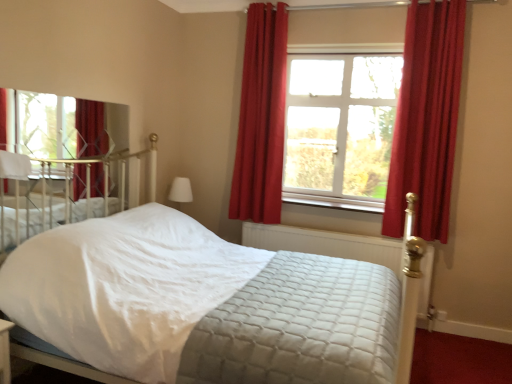
Question: Does wooden at center appear on the right side of white soft pillow at upper left?

Choices:
 (A) yes
 (B) no

Answer: (A)

Question: Does wooden at center have a greater height compared to white soft pillow at upper left?

Choices:
 (A) yes
 (B) no

Answer: (B)

Question: From the image's perspective, would you say wooden at center is shown under white soft pillow at upper left?

Choices:
 (A) yes
 (B) no

Answer: (A)

Question: Can you confirm if wooden at center is bigger than white soft pillow at upper left?

Choices:
 (A) no
 (B) yes

Answer: (B)

Question: Does wooden at center lie in front of white soft pillow at upper left?

Choices:
 (A) yes
 (B) no

Answer: (B)

Question: From the image's perspective, is wooden at center on white soft pillow at upper left?

Choices:
 (A) yes
 (B) no

Answer: (B)

Question: Is clear glass window at center, arranged as the first window when viewed from the back, placed right next to wooden at center?

Choices:
 (A) yes
 (B) no

Answer: (B)

Question: Does clear glass window at center, which is the 2th window from left to right, have a greater height compared to wooden at center?

Choices:
 (A) no
 (B) yes

Answer: (B)

Question: Does clear glass window at center, the 1th window from the right, have a larger size compared to wooden at center?

Choices:
 (A) no
 (B) yes

Answer: (B)

Question: Would you say clear glass window at center, the 1th window from the right, contains wooden at center?

Choices:
 (A) no
 (B) yes

Answer: (A)

Question: From the image's perspective, would you say clear glass window at center, acting as the second window starting from the front, is positioned over wooden at center?

Choices:
 (A) yes
 (B) no

Answer: (A)

Question: Is the depth of clear glass window at center, which is the 2th window from left to right, less than that of wooden at center?

Choices:
 (A) no
 (B) yes

Answer: (A)

Question: Is quilted fabric mattress at center thinner than white quilted fabric bed at center?

Choices:
 (A) yes
 (B) no

Answer: (A)